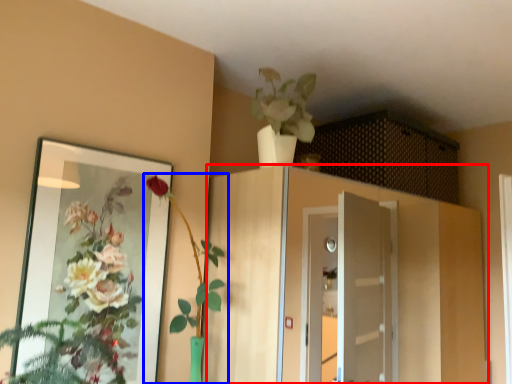
Question: Which point is closer to the camera, cabinetry (highlighted by a red box) or houseplant (highlighted by a blue box)?

Choices:
 (A) cabinetry
 (B) houseplant

Answer: (B)